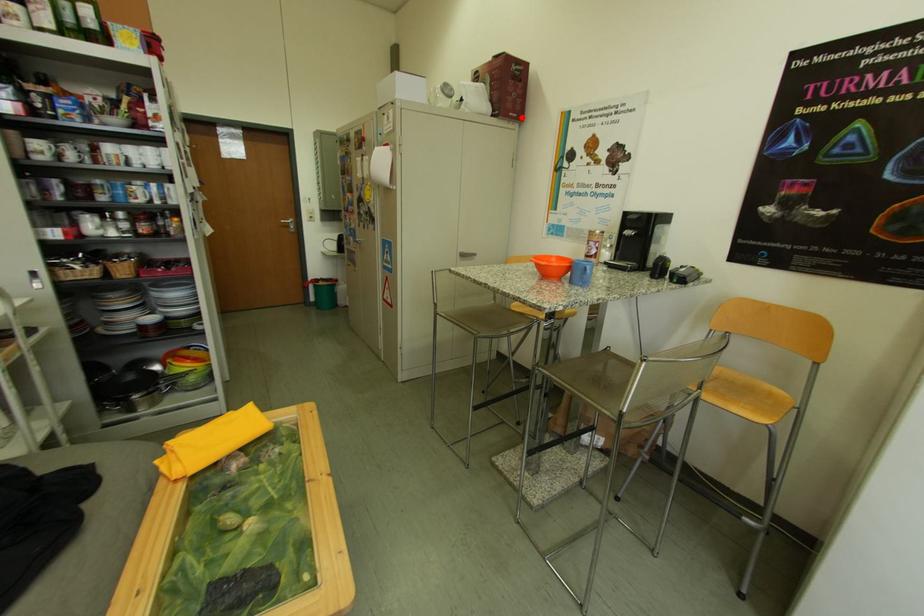
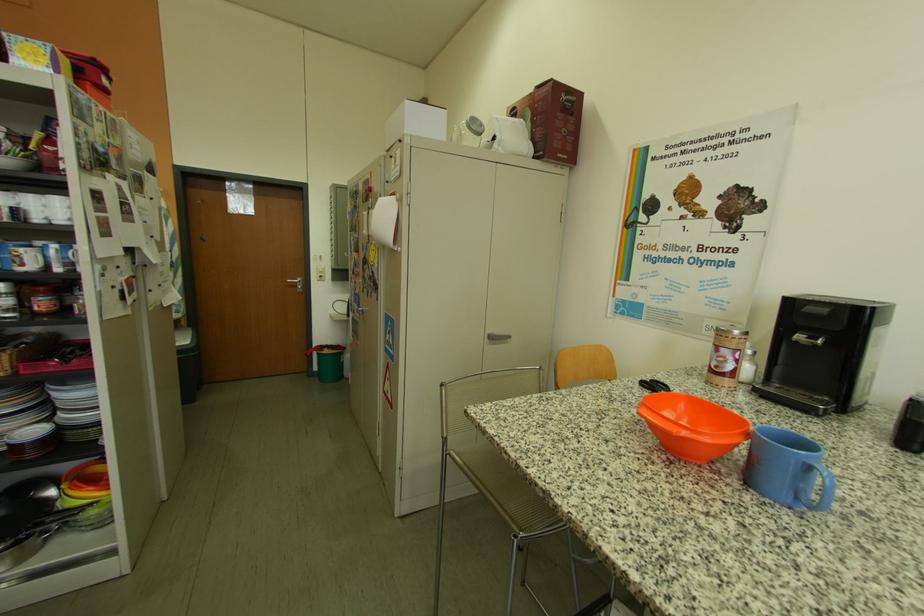
Question: I am providing you with two images of the same scene from different viewpoints. Given a red point in image1, look at the same physical point in image2. Is it:

Choices:
 (A) Closer to the viewpoint
 (B) Farther from the viewpoint

Answer: (B)